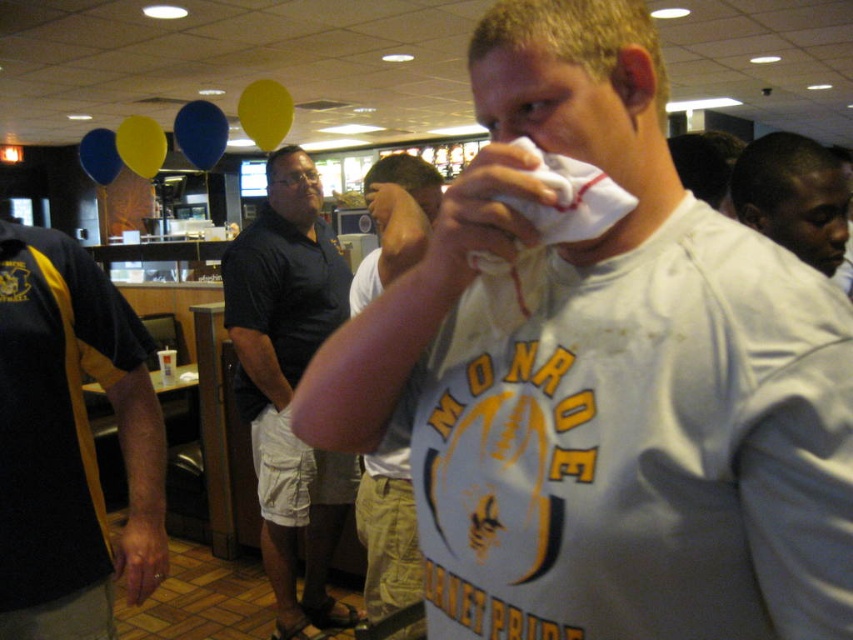
You are a clothing designer observing the scene. You need to determine which shirt has a greater width between the white cotton shirt at center and the black smooth shirt at upper right. Based on the scene description, which one is wider?

The white cotton shirt at center has a greater width than the black smooth shirt at upper right according to the description.